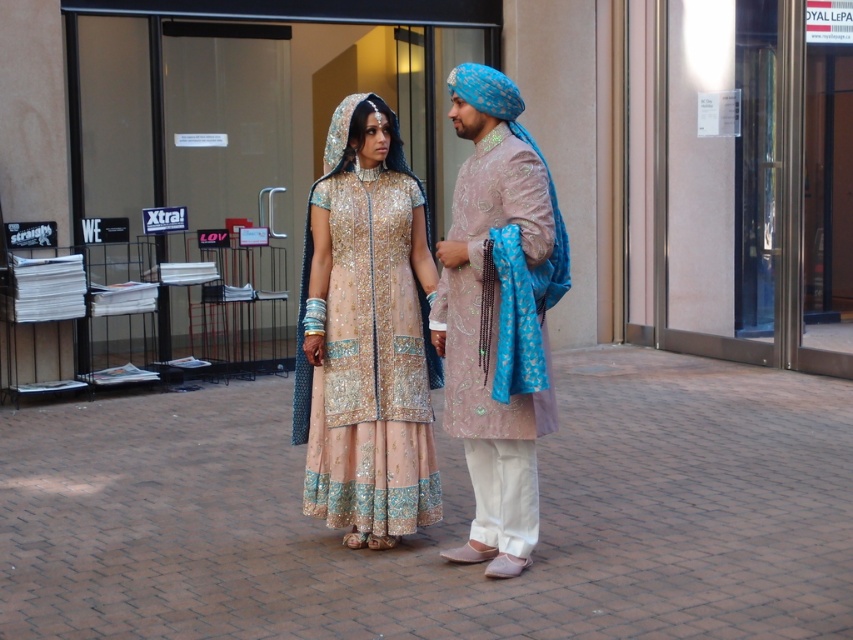
Who is more distant from viewer, (36, 560) or (322, 500)?

Point (322, 500)

Is point (283, 392) positioned before point (357, 481)?

No, (283, 392) is further to viewer.

This screenshot has height=640, width=853. In order to click on brick pavement at center in this screenshot , I will do `click(444, 516)`.

Is point (749, 371) farther from viewer compared to point (479, 120)?

Yes.

Does brick pavement at center have a larger size compared to matte pink kurta at center?

No, brick pavement at center is not bigger than matte pink kurta at center.

Is point (241, 564) farther from camera compared to point (515, 483)?

Yes, it is behind point (515, 483).

Find the location of a particular element. brick pavement at center is located at coordinates (444, 516).

Does matte pink kurta at center have a lesser width compared to pale pink embroidered dress at center?

Yes.

What do you see at coordinates (498, 316) in the screenshot?
I see `matte pink kurta at center` at bounding box center [498, 316].

The width and height of the screenshot is (853, 640). In order to click on matte pink kurta at center in this screenshot , I will do `click(498, 316)`.